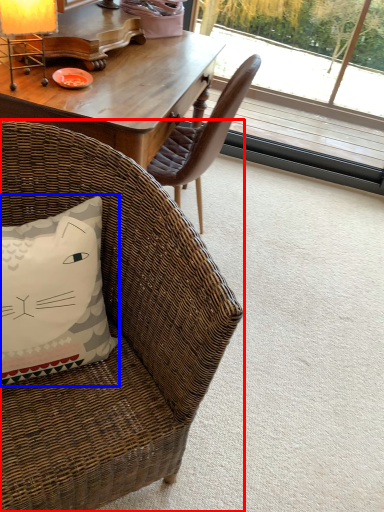
Question: Among these objects, which one is nearest to the camera, chair (highlighted by a red box) or pillow (highlighted by a blue box)?

Choices:
 (A) chair
 (B) pillow

Answer: (A)